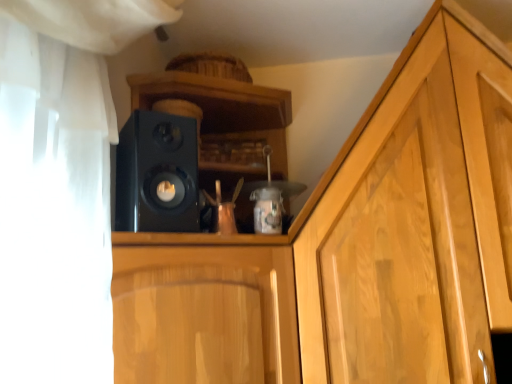
Question: Considering the relative sizes of glossy wood cabinet at center and black matte speaker at center in the image provided, is glossy wood cabinet at center shorter than black matte speaker at center?

Choices:
 (A) no
 (B) yes

Answer: (A)

Question: Can you confirm if glossy wood cabinet at center is thinner than black matte speaker at center?

Choices:
 (A) no
 (B) yes

Answer: (A)

Question: Does glossy wood cabinet at center have a larger size compared to black matte speaker at center?

Choices:
 (A) no
 (B) yes

Answer: (B)

Question: Is glossy wood cabinet at center at the right side of black matte speaker at center?

Choices:
 (A) yes
 (B) no

Answer: (A)

Question: From a real-world perspective, does glossy wood cabinet at center stand above black matte speaker at center?

Choices:
 (A) no
 (B) yes

Answer: (A)

Question: Is glossy wood cabinet at center positioned with its back to black matte speaker at center?

Choices:
 (A) no
 (B) yes

Answer: (A)

Question: From the image's perspective, is black matte speaker at center under glossy wood cabinet at center?

Choices:
 (A) yes
 (B) no

Answer: (B)

Question: Is black matte speaker at center positioned with its back to glossy wood cabinet at center?

Choices:
 (A) no
 (B) yes

Answer: (A)

Question: From the image's perspective, would you say black matte speaker at center is positioned over glossy wood cabinet at center?

Choices:
 (A) yes
 (B) no

Answer: (A)

Question: Is black matte speaker at center smaller than glossy wood cabinet at center?

Choices:
 (A) yes
 (B) no

Answer: (A)

Question: Is the surface of black matte speaker at center in direct contact with glossy wood cabinet at center?

Choices:
 (A) yes
 (B) no

Answer: (B)

Question: Is black matte speaker at center thinner than glossy wood cabinet at center?

Choices:
 (A) yes
 (B) no

Answer: (A)

Question: Is black matte speaker at center wider or thinner than glossy wood cabinet at center?

Choices:
 (A) wide
 (B) thin

Answer: (B)